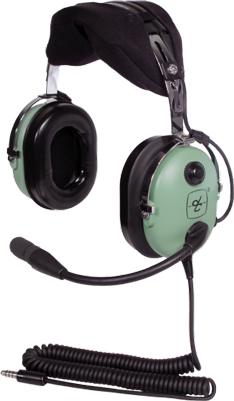
I want to click on ear cushion, so click(x=134, y=216), click(x=59, y=193).